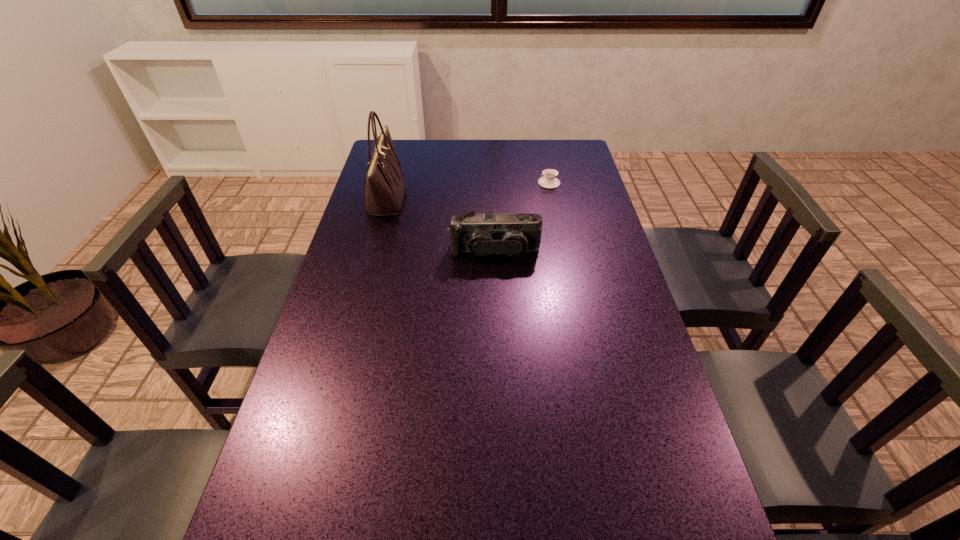
Locate an element on the screen. vacant space located 0.290m on the handle side of the teacup is located at coordinates (461, 183).

Identify the location of object that is positioned at the left edge. This screenshot has height=540, width=960. (384, 191).

Where is `object located in the right edge section of the desktop`? Image resolution: width=960 pixels, height=540 pixels. object located in the right edge section of the desktop is located at coordinates (548, 181).

The height and width of the screenshot is (540, 960). Find the location of `vacant space at the far edge of the desktop`. vacant space at the far edge of the desktop is located at coordinates (520, 148).

In the image, there is a desktop. At what (x,y) coordinates should I click in order to perform the action: click on vacant space at the left edge. Please return your answer as a coordinate pair (x, y). The width and height of the screenshot is (960, 540). Looking at the image, I should click on (352, 431).

Where is `vacant space at the right edge of the desktop`? The width and height of the screenshot is (960, 540). vacant space at the right edge of the desktop is located at coordinates (602, 364).

At what (x,y) coordinates should I click in order to perform the action: click on object identified as the second closest to the teacup. Please return your answer as a coordinate pair (x, y). The width and height of the screenshot is (960, 540). Looking at the image, I should click on (384, 191).

Locate an element on the screen. The image size is (960, 540). object that is the closest one to the leftmost object is located at coordinates (512, 234).

The width and height of the screenshot is (960, 540). Find the location of `free point that satisfies the following two spatial constraints: 1. on the handle side of the shortest object; 2. on the front-facing side of the second object from left to right`. free point that satisfies the following two spatial constraints: 1. on the handle side of the shortest object; 2. on the front-facing side of the second object from left to right is located at coordinates (564, 251).